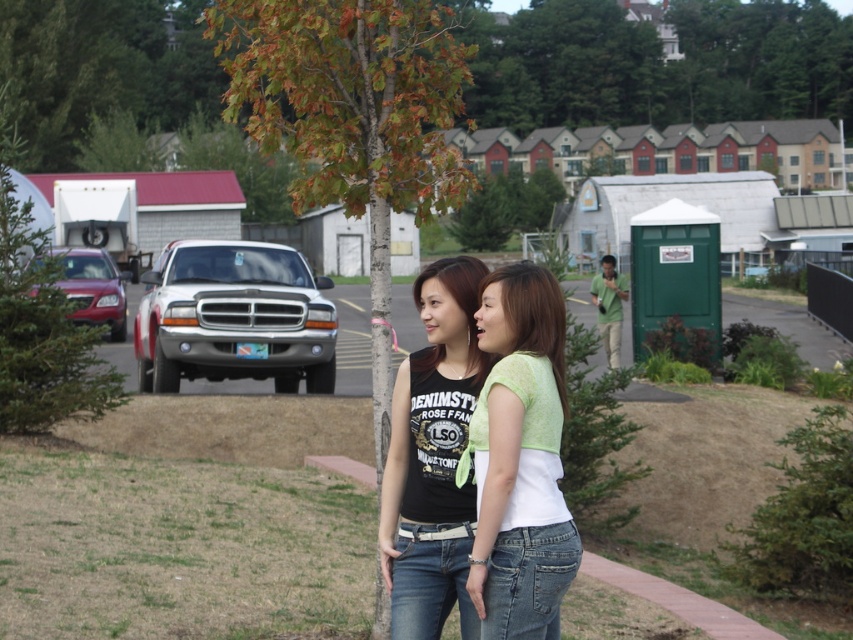
You are a photographer trying to frame a shot of the green cotton shirt at center and the black matte tank top at center. Since you want to highlight the height difference between them, which one should you position closer to the bottom of the frame?

The green cotton shirt at center is shorter than the black matte tank top at center, so to emphasize their height difference, position the green cotton shirt at center closer to the bottom of the frame.

You are a photographer trying to capture a group photo of the two people in the image. You want to ensure both the green cotton shirt at center and the black matte tank top at center are clearly visible in the frame. Given their sizes, which clothing item might you need to adjust the camera angle to highlight more?

The green cotton shirt at center has a smaller size compared to the black matte tank top at center. To ensure both are clearly visible, you might need to adjust the camera angle to highlight the smaller green cotton shirt at center more, so it doesn